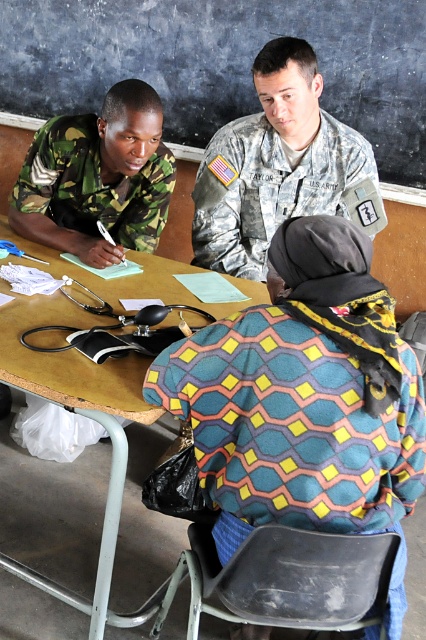
You are a patient entering the clinic and need to sit down at the wooden table at center. The camouflage fabric uniform at upper center is blocking your path. Can you walk around it to reach the table?

The camouflage fabric uniform at upper center is in front of the wooden table at center, so you can walk around it to reach the table since it is blocking the direct path but not the entire area.

You are a medical supply delivery person who needs to place a first aid kit between the camouflage fabric uniform at upper center and the camouflage fabric uniform at left. The first aid kit is 80 centimeters long. Will it fit in the space between them?

The distance between the camouflage fabric uniform at upper center and the camouflage fabric uniform at left is 84.94 centimeters. Since the first aid kit is 80 centimeters long, it will fit in the space between them as there is enough room.